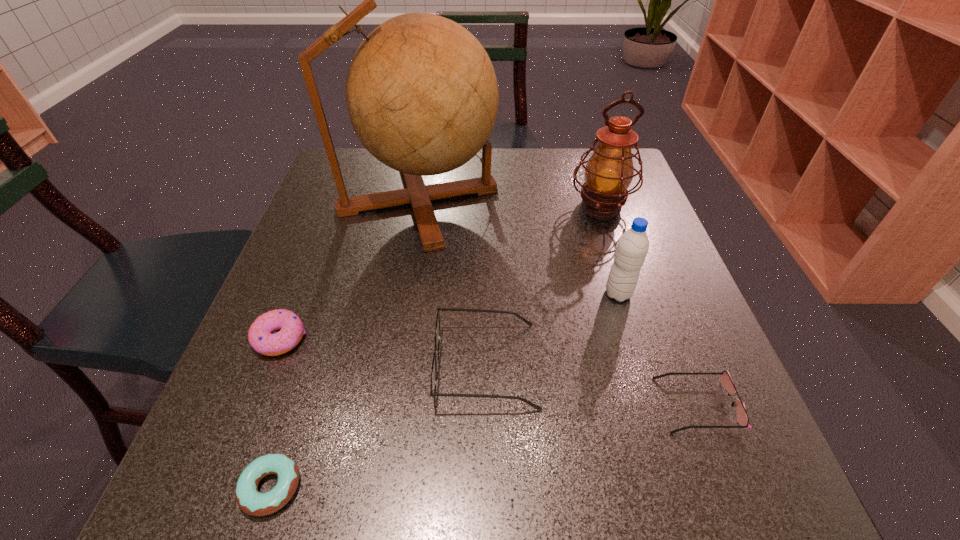
The image size is (960, 540). Identify the location of the tallest object. (422, 96).

Identify the location of the sixth shortest object. This screenshot has height=540, width=960. (609, 172).

The width and height of the screenshot is (960, 540). I want to click on the third farthest object, so click(632, 248).

In order to click on water bottle in this screenshot , I will do `click(632, 248)`.

What are the coordinates of `spectacles` in the screenshot? It's located at (433, 393).

In order to click on the farther doughnut in this screenshot , I will do `click(260, 336)`.

The width and height of the screenshot is (960, 540). Identify the location of the sixth tallest object. (742, 417).

In order to click on the nearer doughnut in this screenshot , I will do `click(251, 501)`.

Find the location of a particular element. This screenshot has width=960, height=540. the nearest object is located at coordinates (251, 501).

Locate an element on the screen. free spot located 0.240m on the surface of the tallest object is located at coordinates (593, 200).